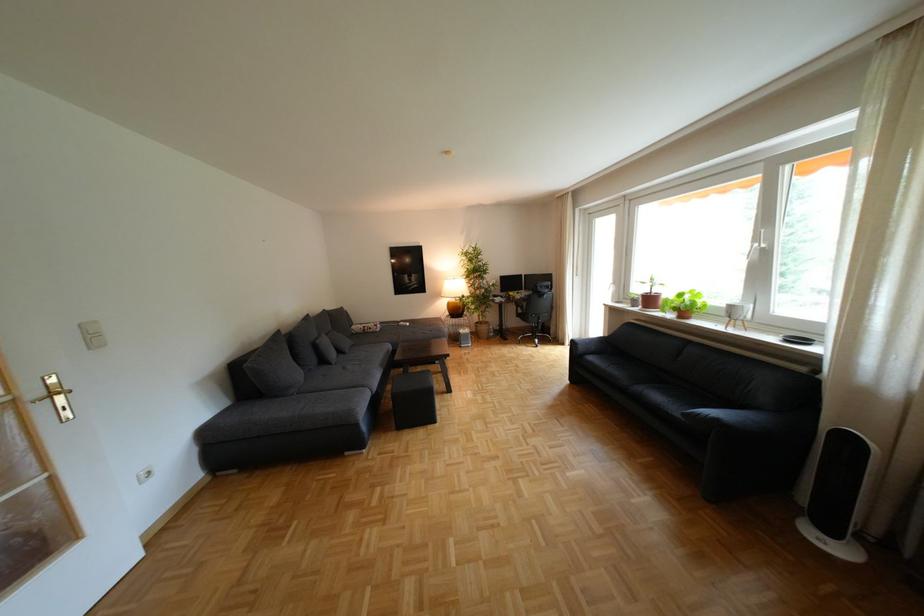
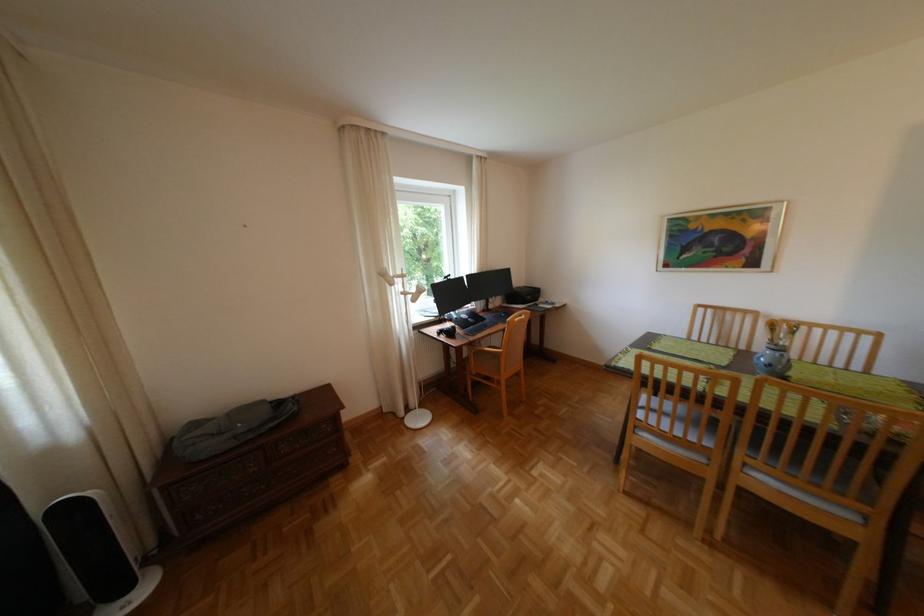
The point at (861, 440) is marked in the first image. Where is the corresponding point in the second image?

(83, 508)